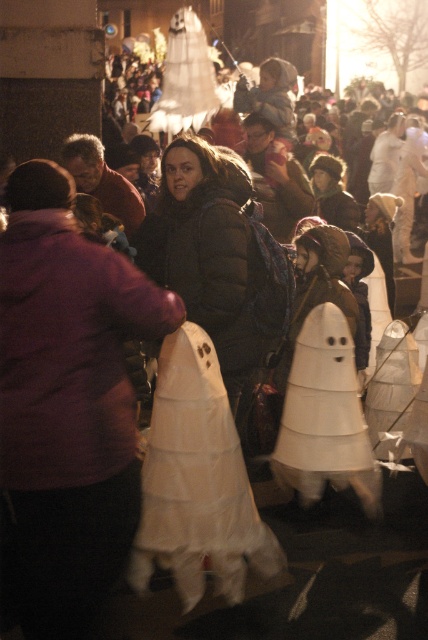
You are a photographer trying to capture a clear photo of both the white paper ghost at center and the white paper cone at center in the nighttime scene. The camera you are using has a limited depth of field that can only focus on objects within a 20 inch range. Will both objects be in focus at the same time?

The white paper ghost at center and the white paper cone at center are 29.79 inches apart, which exceeds the camera lens depth of field range of 20 inches. Therefore, both objects cannot be in focus simultaneously.

You are standing in the middle of the street during the nighttime event. You notice a point marked at coordinates (196,481). What object is located at that point?

The point at coordinates (196,481) corresponds to the white paper ghost at center.

You are at a Halloween party and want to place a small decoration on the table. The table has space for items no larger than 10 inches. You have the white paper ghost at center and the white paper cone at center. Which one can you place on the table without exceeding the size limit?

The white paper ghost at center is smaller than the white paper cone at center, so the white paper ghost at center can be placed on the table without exceeding the 10 inch size limit.